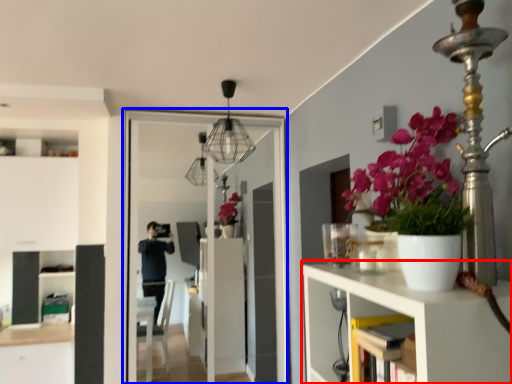
Question: Which object is further to the camera taking this photo, shelf (highlighted by a red box) or screen door (highlighted by a blue box)?

Choices:
 (A) shelf
 (B) screen door

Answer: (B)